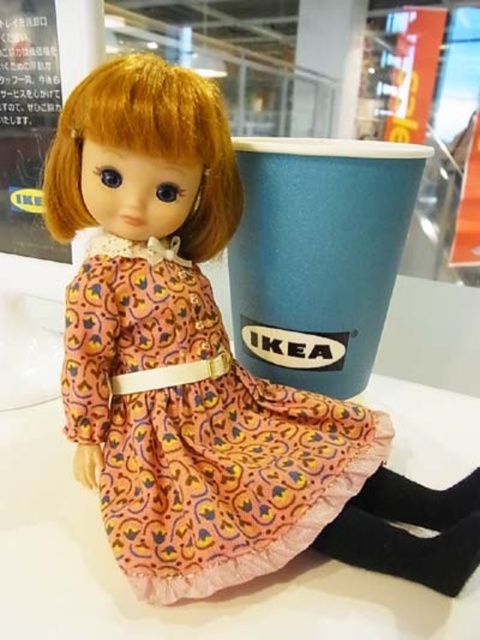
You are a photographer taking a picture of the printed fabric dress at center and the blue paper cup at upper center. Which object will appear larger in the photo?

The printed fabric dress at center will appear larger in the photo because it is closer to the viewer than the blue paper cup at upper center.

You are organizing a dollhouse and need to place the printed fabric dress at center and the blue paper cup at upper center. Based on their sizes, which item would require more space in the dollhouse?

The blue paper cup at upper center requires more space because it is larger than the printed fabric dress at center.